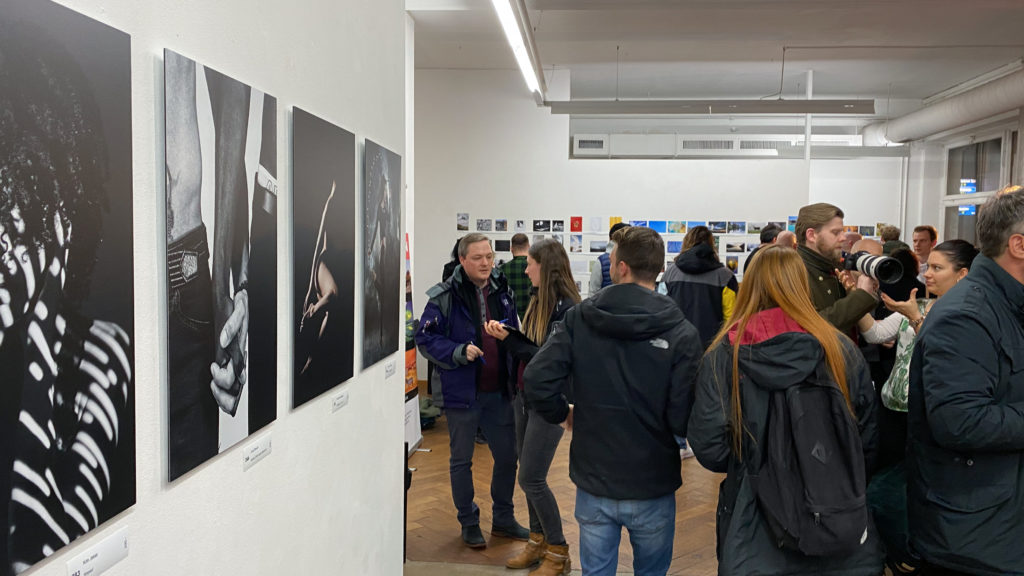
The width and height of the screenshot is (1024, 576). I want to click on left side wall, so click(393, 56), click(215, 21), click(350, 503).